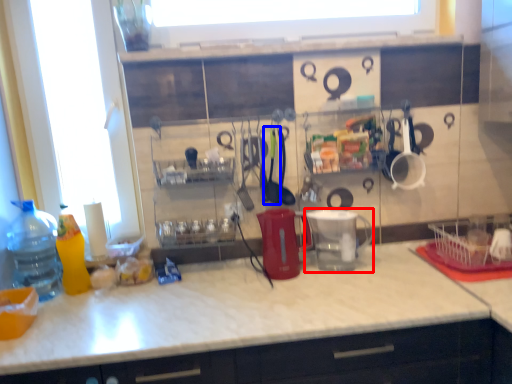
Question: Which object is further to the camera taking this photo, appliance (highlighted by a red box) or tableware (highlighted by a blue box)?

Choices:
 (A) appliance
 (B) tableware

Answer: (B)